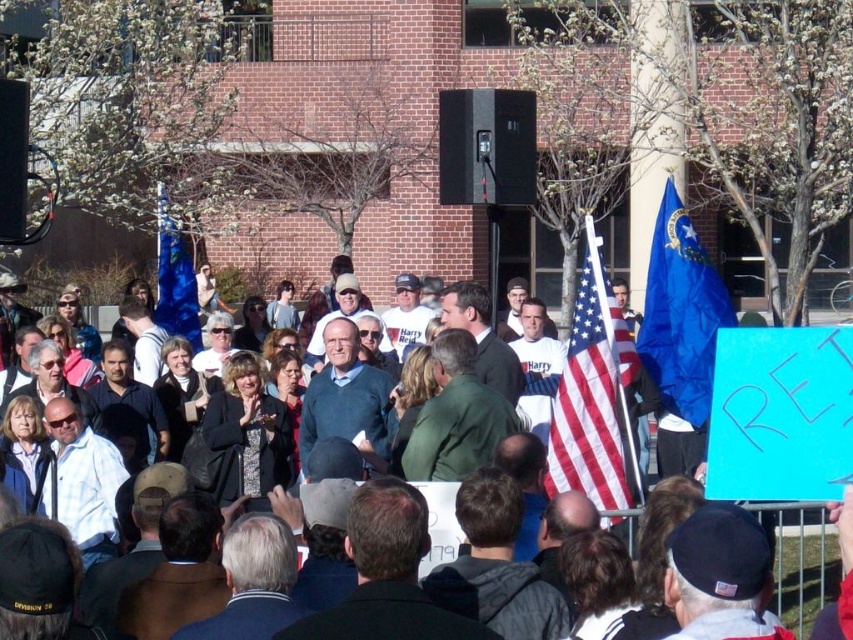
Question: Which point is closer to the camera?

Choices:
 (A) (618, 448)
 (B) (648, 301)

Answer: (A)

Question: Does american flag at center have a lesser width compared to blue fabric flag at center?

Choices:
 (A) yes
 (B) no

Answer: (A)

Question: Among these points, which one is nearest to the camera?

Choices:
 (A) (604, 490)
 (B) (817, 570)

Answer: (A)

Question: Can you confirm if white paper sign at center is thinner than blue fabric flag at center?

Choices:
 (A) yes
 (B) no

Answer: (B)

Question: Can you confirm if white paper sign at center is positioned to the right of blue fabric flag at center?

Choices:
 (A) no
 (B) yes

Answer: (B)

Question: Which object is farther from the camera taking this photo?

Choices:
 (A) blue fabric flag at upper right
 (B) white paper sign at center
 (C) blue fabric flag at center
 (D) american flag at center

Answer: (C)